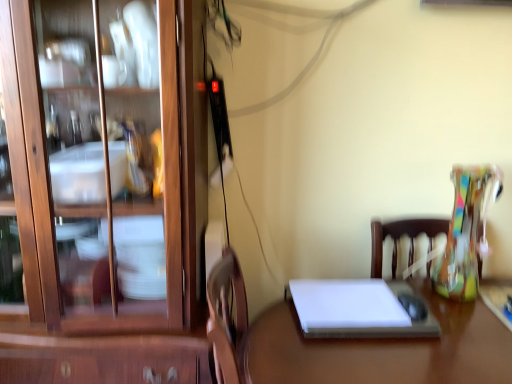
Question: Is wooden cabinet at left turned away from white glossy desk at center?

Choices:
 (A) yes
 (B) no

Answer: (B)

Question: From a real-world perspective, is wooden cabinet at left positioned over white glossy desk at center based on gravity?

Choices:
 (A) no
 (B) yes

Answer: (B)

Question: From the image's perspective, does wooden cabinet at left appear higher than white glossy desk at center?

Choices:
 (A) no
 (B) yes

Answer: (B)

Question: Are wooden cabinet at left and white glossy desk at center beside each other?

Choices:
 (A) no
 (B) yes

Answer: (A)

Question: Is the position of wooden cabinet at left less distant than that of white glossy desk at center?

Choices:
 (A) no
 (B) yes

Answer: (A)

Question: In the image, is white matte notebook at center positioned in front of or behind white glossy desk at center?

Choices:
 (A) front
 (B) behind

Answer: (B)

Question: In terms of width, does white matte notebook at center look wider or thinner when compared to white glossy desk at center?

Choices:
 (A) wide
 (B) thin

Answer: (B)

Question: Choose the correct answer: Is white matte notebook at center inside white glossy desk at center or outside it?

Choices:
 (A) outside
 (B) inside

Answer: (B)

Question: From a real-world perspective, is white matte notebook at center physically located above or below white glossy desk at center?

Choices:
 (A) below
 (B) above

Answer: (B)

Question: Considering the positions of white matte notebook at center and wooden cabinet at left in the image, is white matte notebook at center taller or shorter than wooden cabinet at left?

Choices:
 (A) short
 (B) tall

Answer: (A)

Question: Which is correct: white matte notebook at center is inside wooden cabinet at left, or outside of it?

Choices:
 (A) inside
 (B) outside

Answer: (B)

Question: Based on their sizes in the image, would you say white matte notebook at center is bigger or smaller than wooden cabinet at left?

Choices:
 (A) small
 (B) big

Answer: (A)

Question: Does point (331, 322) appear closer or farther from the camera than point (7, 66)?

Choices:
 (A) farther
 (B) closer

Answer: (A)

Question: Considering their positions, is wooden cabinet at left located in front of or behind white matte notebook at center?

Choices:
 (A) behind
 (B) front

Answer: (B)

Question: From a real-world perspective, is wooden cabinet at left physically located above or below white matte notebook at center?

Choices:
 (A) above
 (B) below

Answer: (A)